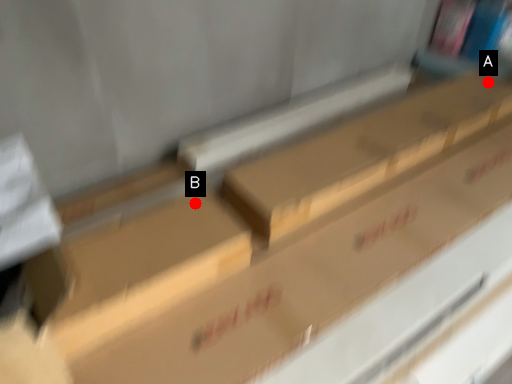
Question: Two points are circled on the image, labeled by A and B beside each circle. Which of the following is the closest to the observer?

Choices:
 (A) A is closer
 (B) B is closer

Answer: (B)